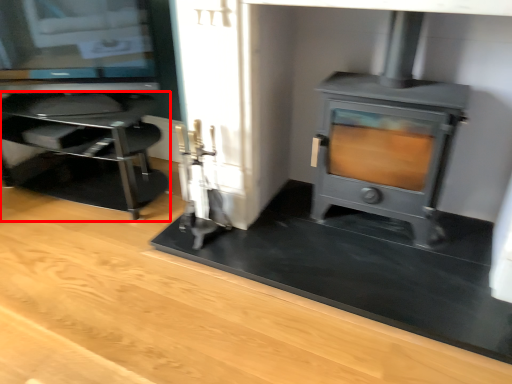
Question: In this image, where is furniture (annotated by the red box) located relative to wood burning stove?

Choices:
 (A) right
 (B) left

Answer: (B)